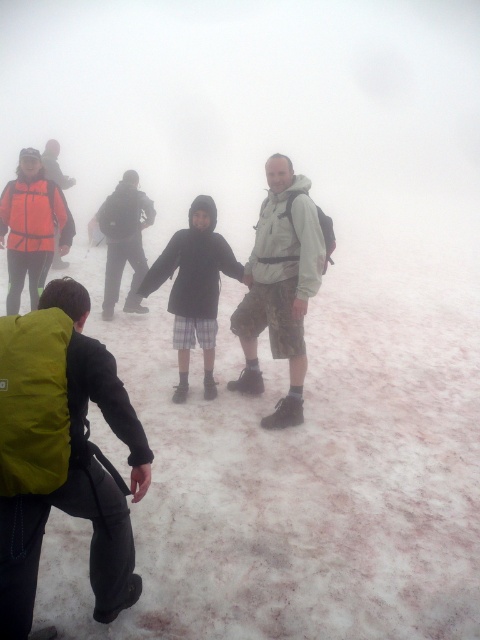
Question: Which of these objects is positioned farthest from the matte black jacket at center?

Choices:
 (A) camouflage shorts at center
 (B) green fabric backpack at lower left
 (C) orange reflective jacket at left

Answer: (B)

Question: Is camouflage shorts at center thinner than orange reflective jacket at left?

Choices:
 (A) yes
 (B) no

Answer: (A)

Question: Which object is closer to the camera taking this photo?

Choices:
 (A) matte black jacket at center
 (B) green fabric backpack at lower left

Answer: (B)

Question: Is green fabric backpack at lower left to the right of matte black jacket at center from the viewer's perspective?

Choices:
 (A) no
 (B) yes

Answer: (A)

Question: Does green fabric backpack at lower left come behind matte black jacket at center?

Choices:
 (A) yes
 (B) no

Answer: (B)

Question: Which of the following is the closest to the observer?

Choices:
 (A) green fabric backpack at lower left
 (B) orange reflective jacket at left
 (C) matte black jacket at center
 (D) camouflage shorts at center

Answer: (A)